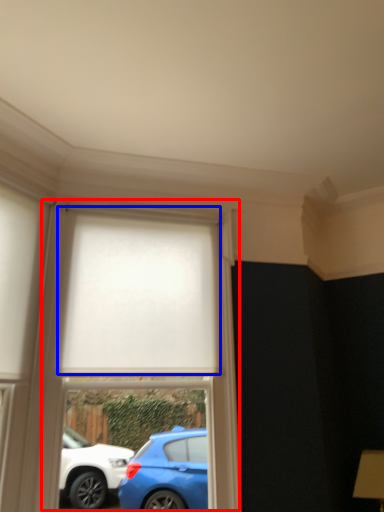
Question: Which object is further to the camera taking this photo, bay window (highlighted by a red box) or curtain (highlighted by a blue box)?

Choices:
 (A) bay window
 (B) curtain

Answer: (B)